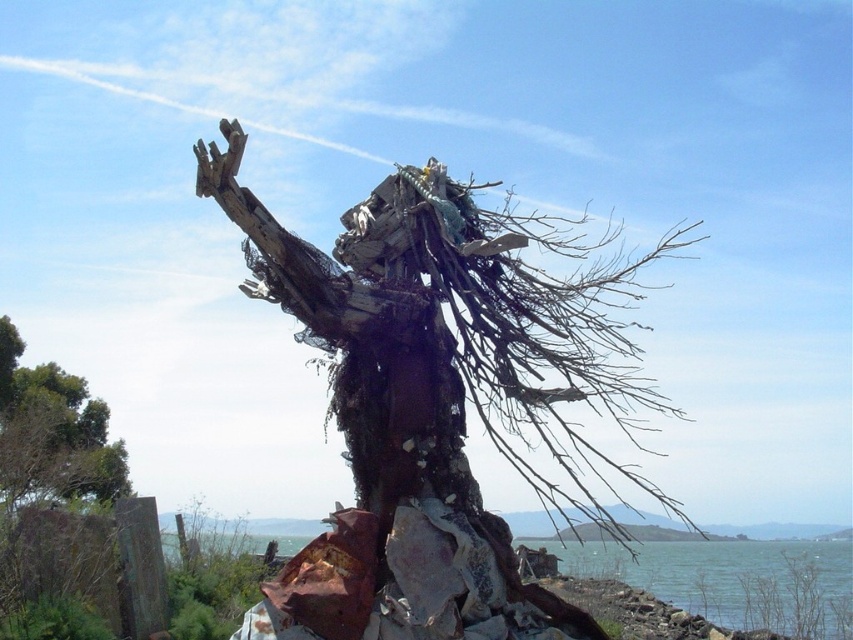
Question: Can you confirm if rusty metal sculpture at center is smaller than blue water at lower center?

Choices:
 (A) no
 (B) yes

Answer: (A)

Question: Does rusty metal sculpture at center have a greater width compared to blue water at lower center?

Choices:
 (A) no
 (B) yes

Answer: (A)

Question: Which object is farther from the camera taking this photo?

Choices:
 (A) rusty metal sculpture at center
 (B) blue water at lower center

Answer: (B)

Question: Which point is farther to the camera?

Choices:
 (A) (808, 570)
 (B) (370, 502)

Answer: (A)

Question: Is rusty metal sculpture at center to the left of blue water at lower center from the viewer's perspective?

Choices:
 (A) no
 (B) yes

Answer: (B)

Question: Which of the following is the farthest from the observer?

Choices:
 (A) blue water at lower center
 (B) rusty metal sculpture at center

Answer: (A)